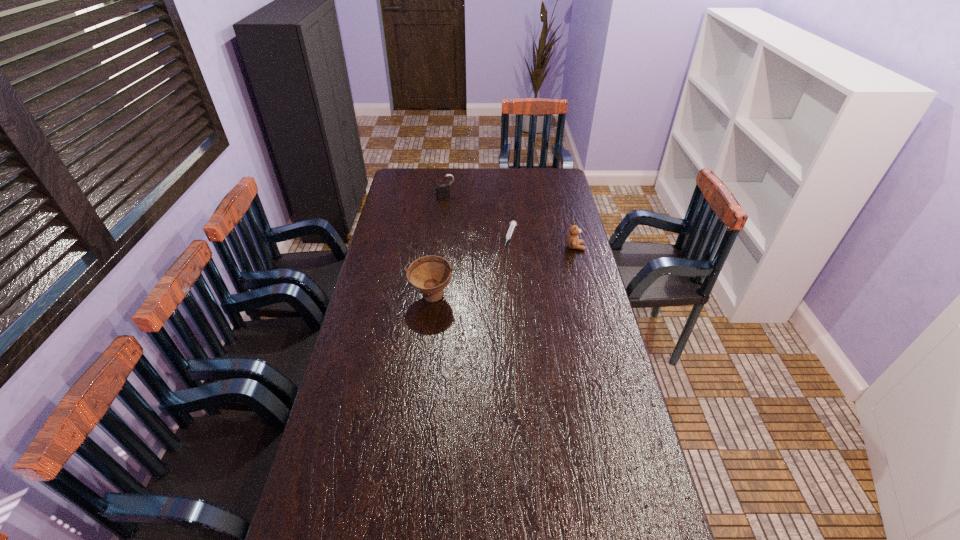
In order to click on the tallest object in this screenshot , I will do `click(429, 275)`.

Image resolution: width=960 pixels, height=540 pixels. What are the coordinates of `soup bowl` in the screenshot? It's located at point(429,275).

This screenshot has height=540, width=960. What are the coordinates of `the rightmost object` in the screenshot? It's located at click(573, 242).

The height and width of the screenshot is (540, 960). Identify the location of the third object from left to right. (512, 224).

Identify the location of the shortest object. The width and height of the screenshot is (960, 540). (512, 224).

Where is `the farthest object`? The height and width of the screenshot is (540, 960). the farthest object is located at coordinates (443, 191).

You are a GUI agent. You are given a task and a screenshot of the screen. Output one action in this format:
    pyautogui.click(x=<x>, y=<y>)
    Task: Click on the blank space located 0.380m on the front of the soup bowl
    
    Given the screenshot: What is the action you would take?
    pyautogui.click(x=419, y=404)

Identify the location of free space located at the needle end of the syringe. (495, 286).

The image size is (960, 540). I want to click on vacant space located 0.080m at the needle end of the syringe, so click(x=506, y=259).

I want to click on vacant region located at the needle end of the syringe, so click(x=488, y=307).